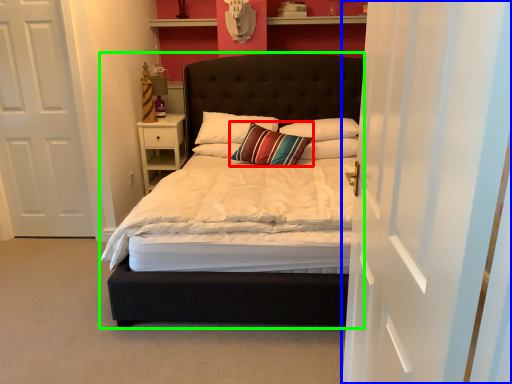
Question: Which object is the farthest from pillow (highlighted by a red box)? Choose among these: curtain (highlighted by a blue box) or bed (highlighted by a green box).

Choices:
 (A) curtain
 (B) bed

Answer: (A)